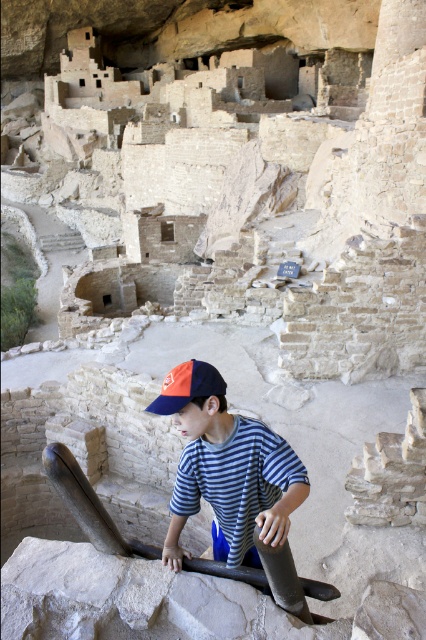
Question: Which point is farther to the camera?

Choices:
 (A) striped cotton shirt at center
 (B) orange/red fabric cap at lower center

Answer: (B)

Question: Is striped cotton shirt at center positioned before orange/red fabric cap at lower center?

Choices:
 (A) yes
 (B) no

Answer: (A)

Question: Does striped cotton shirt at center appear under orange/red fabric cap at lower center?

Choices:
 (A) no
 (B) yes

Answer: (B)

Question: Which point is closer to the camera?

Choices:
 (A) striped cotton shirt at center
 (B) orange/red fabric cap at lower center

Answer: (A)

Question: Observing the image, what is the correct spatial positioning of striped cotton shirt at center in reference to orange/red fabric cap at lower center?

Choices:
 (A) below
 (B) above

Answer: (A)